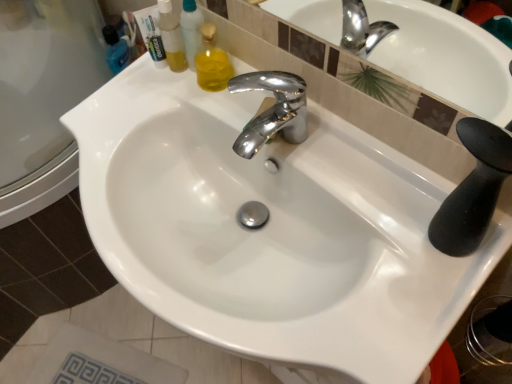
Where is `free spot in front of translucent plastic bottle at upper left`? free spot in front of translucent plastic bottle at upper left is located at coordinates (168, 107).